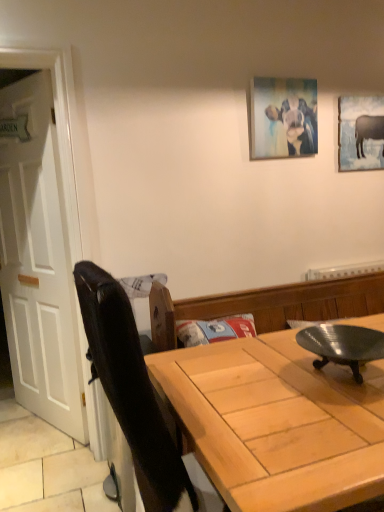
Where is `free space in front of metallic silver plate at center`? The width and height of the screenshot is (384, 512). free space in front of metallic silver plate at center is located at coordinates (336, 416).